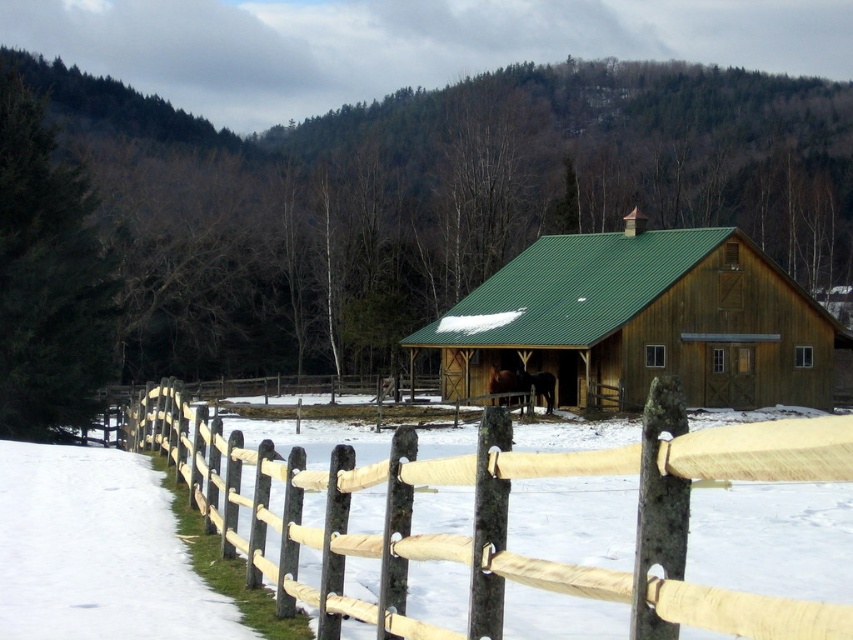
Question: Where is wooden split rail fence at center located in relation to white powdery snow at lower left in the image?

Choices:
 (A) left
 (B) right

Answer: (B)

Question: Which point is closer to the camera?

Choices:
 (A) green wooden barn at center
 (B) white powdery snow at lower left
 (C) wooden split rail fence at center

Answer: (C)

Question: Which object appears closest to the camera in this image?

Choices:
 (A) white powdery snow at lower left
 (B) wooden split rail fence at center

Answer: (B)

Question: Can you confirm if green wooden barn at center is positioned to the left of white powdery snow at lower left?

Choices:
 (A) yes
 (B) no

Answer: (B)

Question: Which is nearer to the wooden split rail fence at center?

Choices:
 (A) green wooden barn at center
 (B) white powdery snow at lower left

Answer: (B)

Question: Can you confirm if wooden split rail fence at center is positioned above white powdery snow at lower left?

Choices:
 (A) no
 (B) yes

Answer: (A)